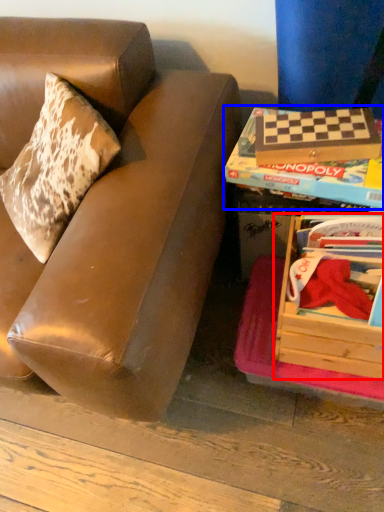
Question: Which of the following is the closest to the observer, box (highlighted by a red box) or paperback book (highlighted by a blue box)?

Choices:
 (A) box
 (B) paperback book

Answer: (A)